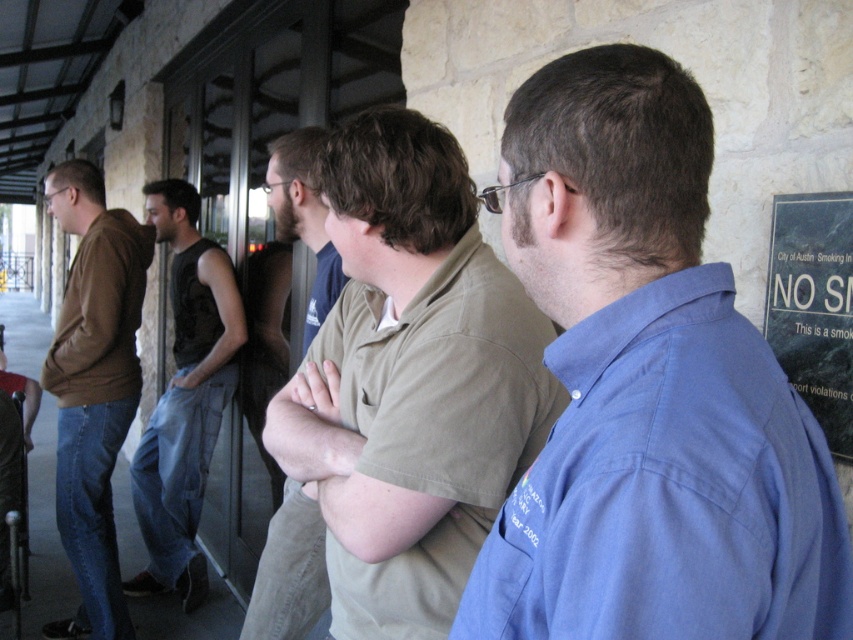
Does blue cotton shirt at center lie behind matte brown hoodie at left?

No, it is in front of matte brown hoodie at left.

Is point (646, 538) positioned behind point (97, 456)?

That is False.

Find the location of a particular element. This screenshot has height=640, width=853. blue cotton shirt at center is located at coordinates (648, 390).

Can you confirm if dark gray sleeveless shirt at left is smaller than light brown shirt at center?

Actually, dark gray sleeveless shirt at left might be larger than light brown shirt at center.

Is point (181, 268) positioned in front of point (297, 154)?

No, (181, 268) is behind (297, 154).

I want to click on dark gray sleeveless shirt at left, so click(184, 396).

Can you confirm if matte brown hoodie at left is taller than light brown shirt at center?

Indeed, matte brown hoodie at left has a greater height compared to light brown shirt at center.

Between point (108, 316) and point (305, 145), which one is positioned in front?

Point (305, 145) is in front.

Find the location of a particular element. matte brown hoodie at left is located at coordinates (93, 387).